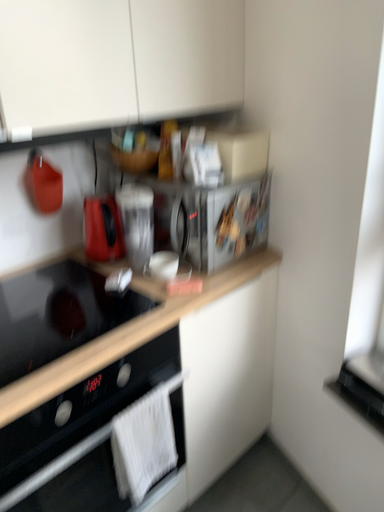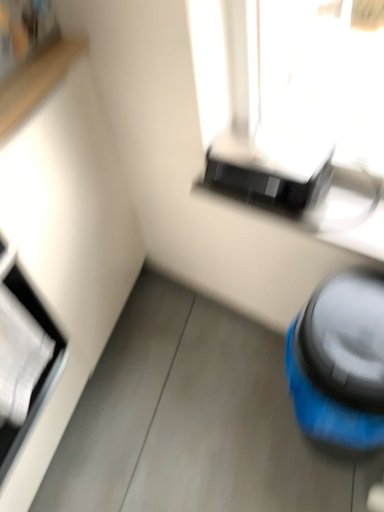
Question: Which way did the camera rotate in the video?

Choices:
 (A) rotated right
 (B) rotated left

Answer: (A)